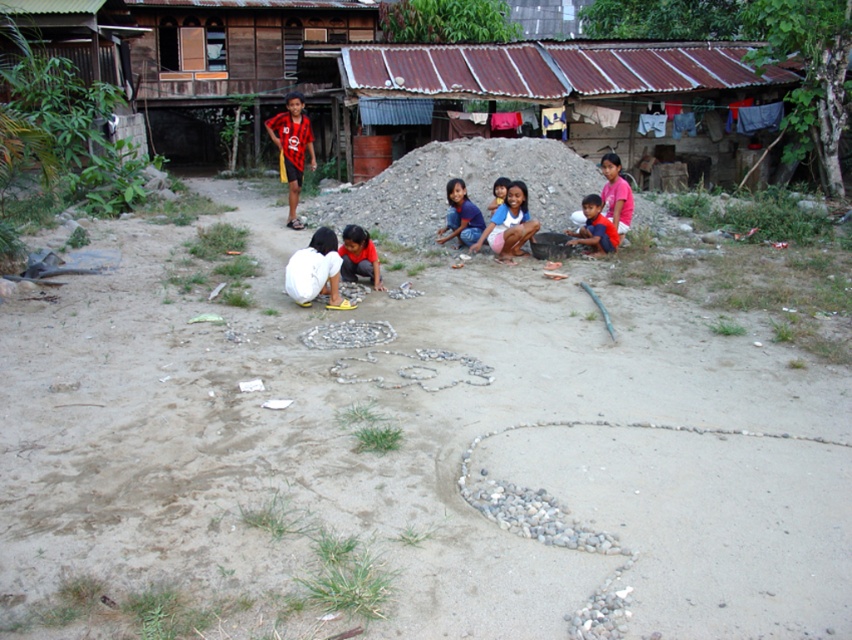
Looking at this image, you are a photographer trying to capture a photo of the brown sandy dirt field at center and the pink cotton shorts at center. Which object should you focus on first if you want both to be in sharp focus?

→ You should focus on the brown sandy dirt field at center first because it is closer to the camera than the pink cotton shorts at center. By focusing on the closer object, the background object will also be in focus due to the depth of field.

You are a photographer trying to capture a wide shot of the brown sandy dirt field at center and the pink cotton shorts at center. Given that the field is narrower than the shorts, which object should you position closer to the camera to ensure both fit in the frame?

Since the brown sandy dirt field at center is narrower than the pink cotton shorts at center, you should position the pink cotton shorts at center closer to the camera. This way, its smaller apparent size will better match the width of the brown sandy dirt field at center, allowing both to fit within the frame.

Looking at this image, you are a photographer trying to capture both the point at (596, 248) and the point at (502, 186) in a single shot. Based on their positions, which point will appear closer to the camera in the photo?

Point (596, 248) will appear closer to the camera in the photo because it is further to the camera than point (502, 186).